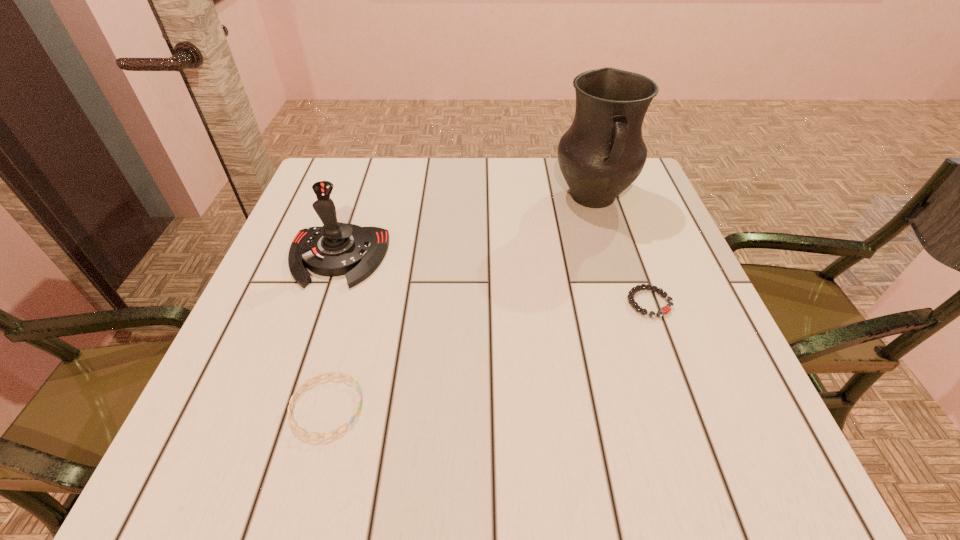
I want to click on free space between the pitcher and the shortest object, so click(621, 250).

The width and height of the screenshot is (960, 540). In order to click on free area in between the nearest object and the farthest object in this screenshot , I will do `click(460, 302)`.

At what (x,y) coordinates should I click in order to perform the action: click on free space between the nearer bracelet and the right bracelet. Please return your answer as a coordinate pair (x, y). Looking at the image, I should click on click(488, 355).

The image size is (960, 540). In order to click on blank region between the second tallest object and the farthest object in this screenshot , I will do click(466, 227).

The image size is (960, 540). I want to click on free space that is in between the left bracelet and the farthest object, so click(460, 302).

Locate an element on the screen. The height and width of the screenshot is (540, 960). object that stands as the third closest to the pitcher is located at coordinates (x=290, y=419).

Choose which object is the second nearest neighbor to the farthest object. Please provide its 2D coordinates. Your answer should be formatted as a tuple, i.e. [(x, y)], where the tuple contains the x and y coordinates of a point satisfying the conditions above.

[(335, 249)]

Where is `free location that satisfies the following two spatial constraints: 1. on the handle side of the farthest object; 2. on the surface of the left bracelet showing star-shaped elements`? Image resolution: width=960 pixels, height=540 pixels. free location that satisfies the following two spatial constraints: 1. on the handle side of the farthest object; 2. on the surface of the left bracelet showing star-shaped elements is located at coordinates (659, 407).

Where is `vacant region that satisfies the following two spatial constraints: 1. on the handle side of the pitcher; 2. on the surface of the nearest object showing star-shaped elements`? The height and width of the screenshot is (540, 960). vacant region that satisfies the following two spatial constraints: 1. on the handle side of the pitcher; 2. on the surface of the nearest object showing star-shaped elements is located at coordinates (659, 407).

You are a GUI agent. You are given a task and a screenshot of the screen. Output one action in this format:
    pyautogui.click(x=<x>, y=<y>)
    Task: Click on the free space that satisfies the following two spatial constraints: 1. on the handle side of the shorter bracelet; 2. on the left side of the tallest object
    
    Given the screenshot: What is the action you would take?
    pyautogui.click(x=626, y=303)